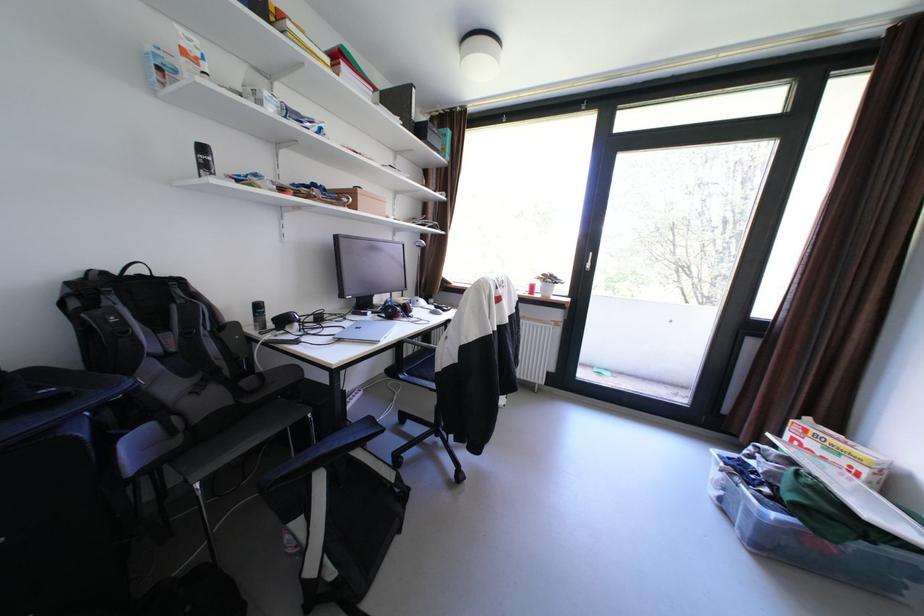
At what (x,y) coordinates should I click in order to perform the action: click on cardboard detergent box. Please return your answer as a coordinate pair (x, y). Looking at the image, I should click on (811, 541).